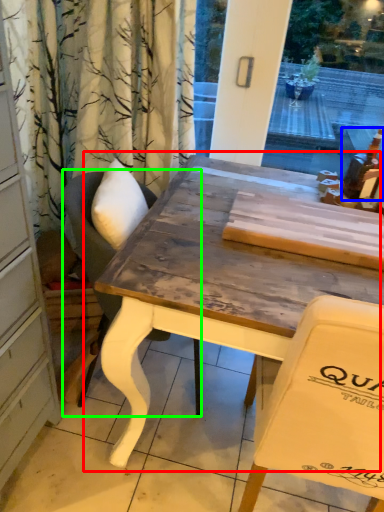
Question: Which is nearer to the table (highlighted by a red box)? alcohol (highlighted by a blue box) or chair (highlighted by a green box).

Choices:
 (A) alcohol
 (B) chair

Answer: (B)